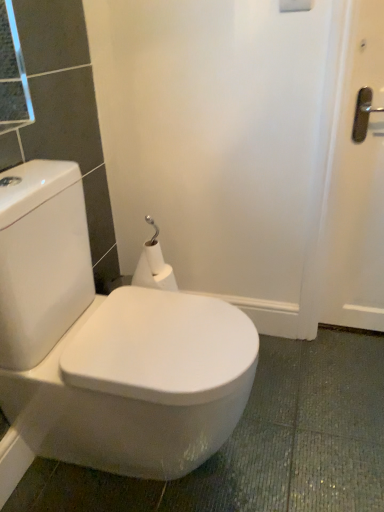
Question: From the image's perspective, is white glossy toilet at center above or below white matte toilet paper at center?

Choices:
 (A) above
 (B) below

Answer: (B)

Question: In terms of size, does white glossy toilet at center appear bigger or smaller than white matte toilet paper at center?

Choices:
 (A) big
 (B) small

Answer: (A)

Question: Is white glossy toilet at center taller or shorter than white matte toilet paper at center?

Choices:
 (A) tall
 (B) short

Answer: (A)

Question: From the image's perspective, is white matte toilet paper at center above or below white glossy toilet at center?

Choices:
 (A) below
 (B) above

Answer: (B)

Question: Is white matte toilet paper at center situated inside white glossy toilet at center or outside?

Choices:
 (A) outside
 (B) inside

Answer: (A)

Question: Considering their positions, is white matte toilet paper at center located in front of or behind white glossy toilet at center?

Choices:
 (A) front
 (B) behind

Answer: (B)

Question: Considering the positions of white matte toilet paper at center and white glossy toilet at center in the image, is white matte toilet paper at center taller or shorter than white glossy toilet at center?

Choices:
 (A) tall
 (B) short

Answer: (B)